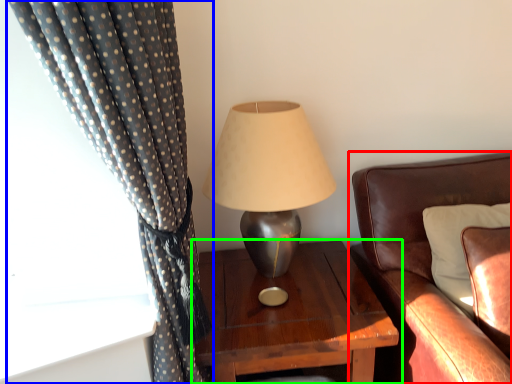
Question: Which object is positioned closest to studio couch (highlighted by a red box)? Select from curtain (highlighted by a blue box) and nightstand (highlighted by a green box).

Choices:
 (A) curtain
 (B) nightstand

Answer: (B)